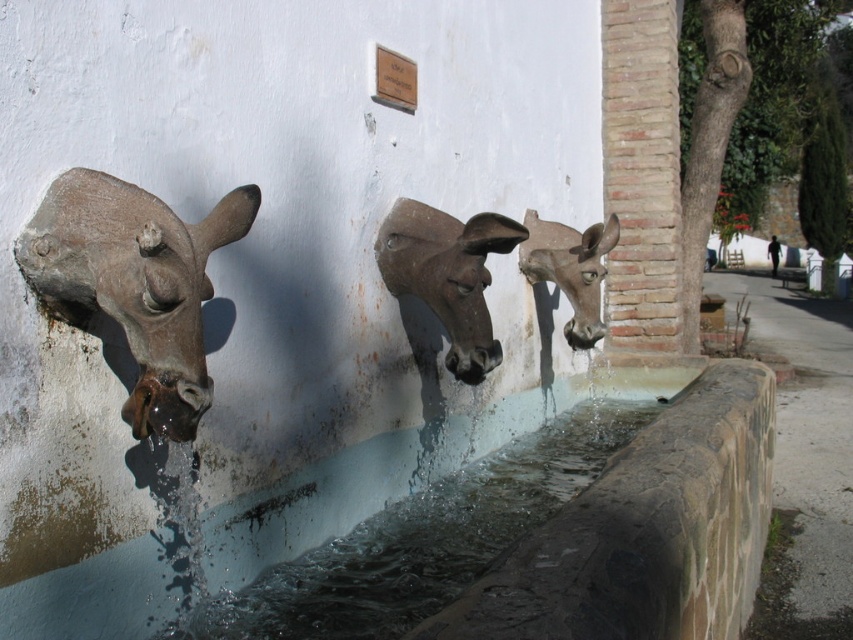
Does matte brown stone cow head at left have a lesser width compared to rustic stone donkey head at center?

Yes.

Does point (149, 237) come farther from viewer compared to point (444, 292)?

No, (149, 237) is closer to viewer.

Locate an element on the screen. Image resolution: width=853 pixels, height=640 pixels. matte brown stone cow head at left is located at coordinates [134, 282].

Is point (335, 624) more distant than point (560, 269)?

No, (335, 624) is closer to viewer.

Which is above, clear liquid water at center or matte gray donkey head at center?

matte gray donkey head at center is above.

Describe the element at coordinates (422, 538) in the screenshot. I see `clear liquid water at center` at that location.

You are a GUI agent. You are given a task and a screenshot of the screen. Output one action in this format:
    pyautogui.click(x=<x>, y=<y>)
    Task: Click on the clear liquid water at center
    This screenshot has width=853, height=640.
    Given the screenshot: What is the action you would take?
    pyautogui.click(x=422, y=538)

Is clear liquid water at center positioned in front of matte brown stone cow head at left?

That is False.

Does clear liquid water at center appear under matte brown stone cow head at left?

Correct, clear liquid water at center is located below matte brown stone cow head at left.

Is point (387, 566) closer to camera compared to point (129, 292)?

No.

At what (x,y) coordinates should I click in order to perform the action: click on clear liquid water at center. Please return your answer as a coordinate pair (x, y). Looking at the image, I should click on (422, 538).